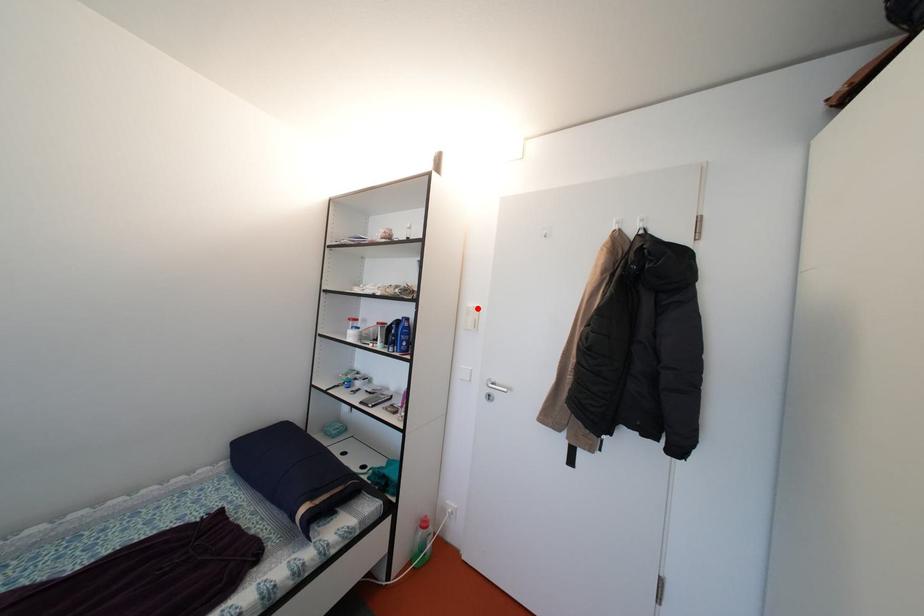
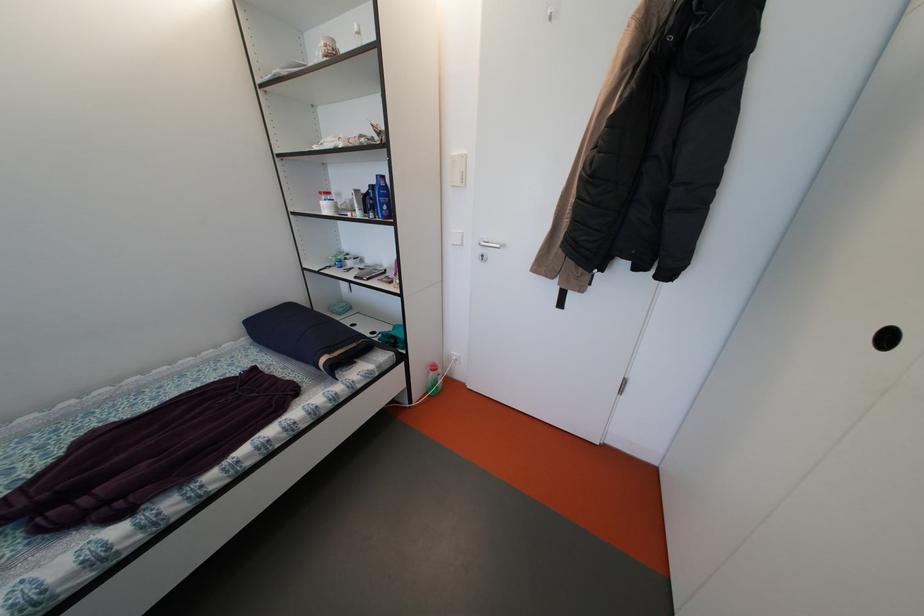
Find the pixel in the second image that matches the highlighted location in the first image.

(462, 156)